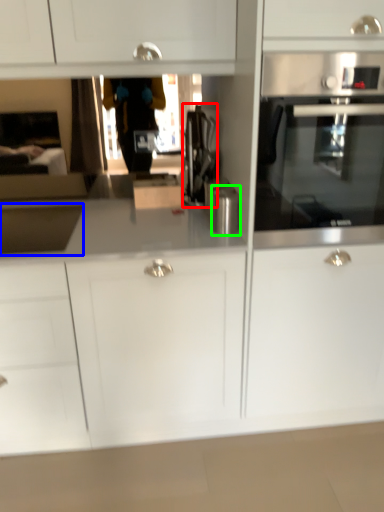
Question: Which is farther away from coffee machine (highlighted by a red box)? sink (highlighted by a blue box) or kitchen appliance (highlighted by a green box)?

Choices:
 (A) sink
 (B) kitchen appliance

Answer: (A)